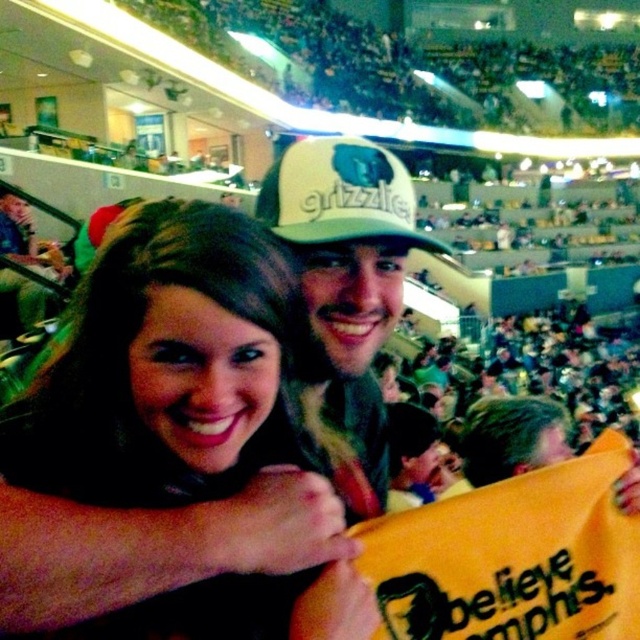
Question: Does smooth brown hair at center have a lesser width compared to white textured cap at center?

Choices:
 (A) no
 (B) yes

Answer: (B)

Question: Is smooth brown hair at center positioned behind white matte baseball cap at center?

Choices:
 (A) no
 (B) yes

Answer: (A)

Question: Among these objects, which one is nearest to the camera?

Choices:
 (A) white textured cap at center
 (B) white matte baseball cap at center

Answer: (B)

Question: Based on their relative distances, which object is nearer to the smooth brown hair at center?

Choices:
 (A) white matte baseball cap at center
 (B) white textured cap at center

Answer: (B)

Question: Which point is closer to the camera?

Choices:
 (A) white textured cap at center
 (B) smooth brown hair at center
 (C) white matte baseball cap at center

Answer: (B)

Question: Is smooth brown hair at center further to the viewer compared to white textured cap at center?

Choices:
 (A) yes
 (B) no

Answer: (B)